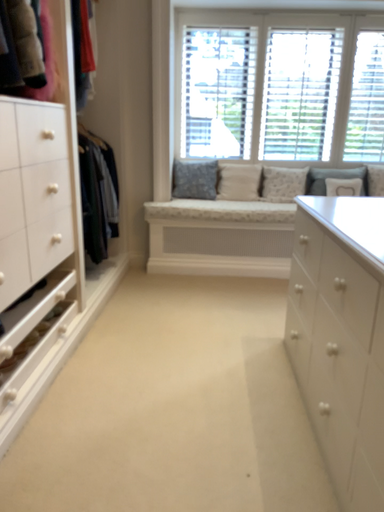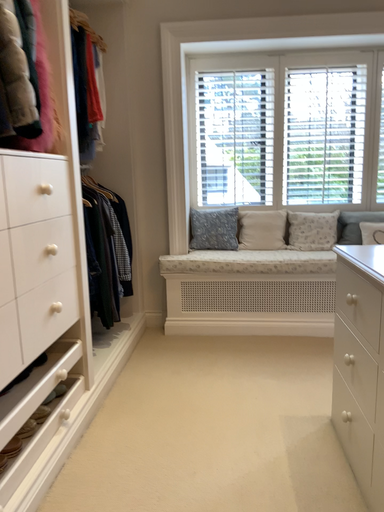
Question: Which way did the camera rotate in the video?

Choices:
 (A) rotated downward
 (B) rotated upward

Answer: (B)